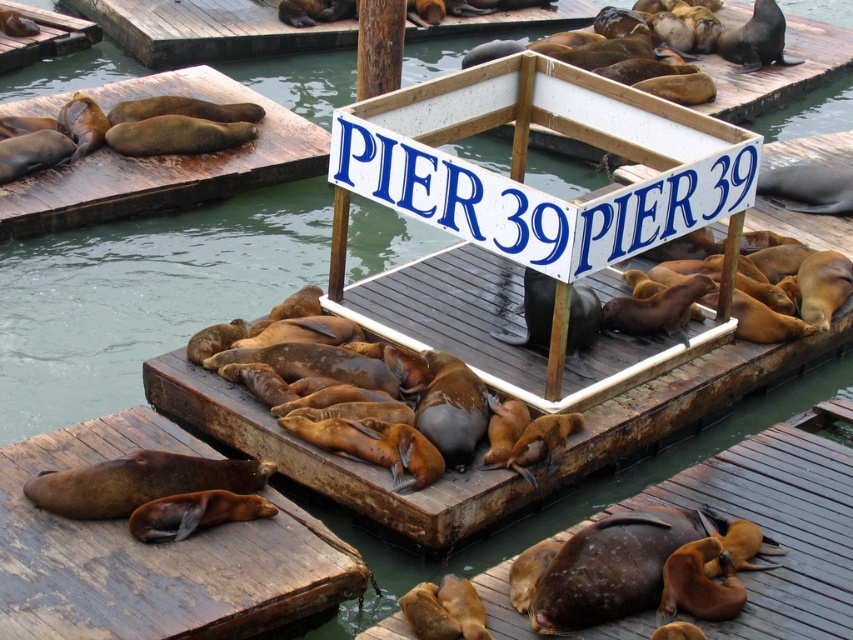
Question: Which of the following is the farthest from the observer?

Choices:
 (A) (78, 204)
 (B) (749, 436)
 (C) (253, 632)

Answer: (A)

Question: Does brown wood dock at lower left have a larger size compared to brown wood dock at upper left?

Choices:
 (A) no
 (B) yes

Answer: (A)

Question: Where is brown wood dock at lower left located in relation to brown matte dock at lower center in the image?

Choices:
 (A) right
 (B) left

Answer: (B)

Question: Which object is closer to the camera taking this photo?

Choices:
 (A) brown wood dock at lower left
 (B) brown wood dock at upper left

Answer: (A)

Question: Estimate the real-world distances between objects in this image. Which object is closer to the brown wood dock at lower left?

Choices:
 (A) brown wood dock at upper left
 (B) brown matte dock at lower center

Answer: (B)

Question: Is brown wood dock at lower left further to the viewer compared to brown matte dock at lower center?

Choices:
 (A) yes
 (B) no

Answer: (B)